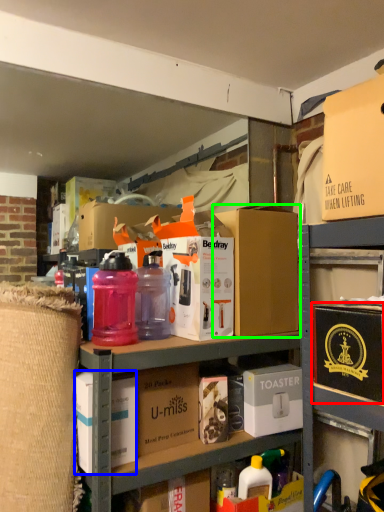
Question: Based on their relative distances, which object is farther from box (highlighted by a red box)? Choose from box (highlighted by a blue box) and box (highlighted by a green box).

Choices:
 (A) box
 (B) box

Answer: (A)